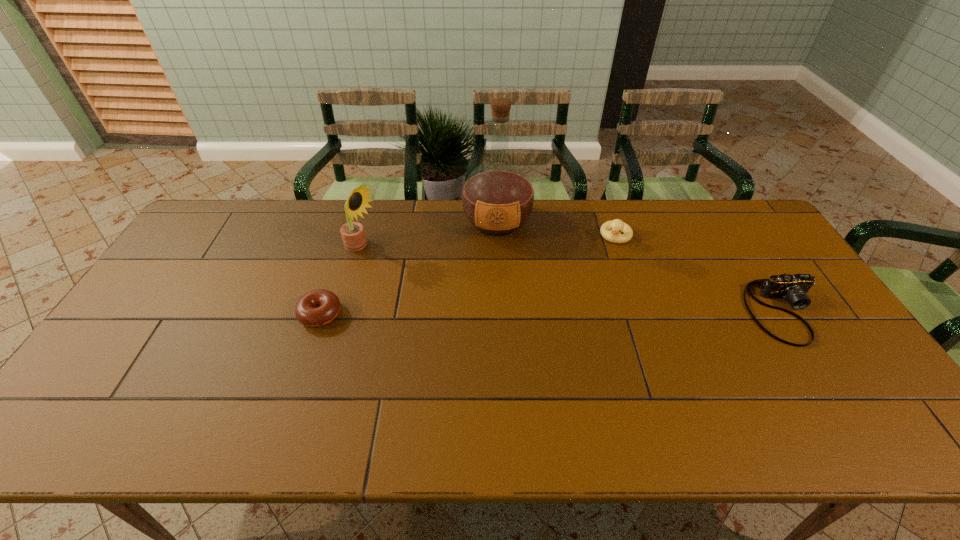
Locate an element on the screen. vacant space in between the doughnut and the sunflower is located at coordinates (341, 281).

This screenshot has height=540, width=960. I want to click on vacant space that's between the rightmost object and the sunflower, so click(573, 280).

In order to click on unoccupied position between the second shortest object and the doughnut in this screenshot , I will do `click(552, 313)`.

At what (x,y) coordinates should I click in order to perform the action: click on vacant space in between the tallest object and the second shortest object. Please return your answer as a coordinate pair (x, y). This screenshot has height=540, width=960. Looking at the image, I should click on (640, 267).

I want to click on vacant area that lies between the third object from right to left and the sunflower, so click(x=430, y=235).

At what (x,y) coordinates should I click in order to perform the action: click on free space between the duckling and the rightmost object. Please return your answer as a coordinate pair (x, y). This screenshot has height=540, width=960. Looking at the image, I should click on (700, 274).

Locate an element on the screen. free space between the shortest object and the liquor is located at coordinates (409, 268).

Where is `the second closest object to the second object from right to left`? the second closest object to the second object from right to left is located at coordinates (793, 288).

Locate an element on the screen. This screenshot has height=540, width=960. object that can be found as the closest to the duckling is located at coordinates (497, 198).

This screenshot has height=540, width=960. Identify the location of vacant space that satisfies the following two spatial constraints: 1. on the front side of the third object from right to left; 2. on the left side of the duckling. (497, 236).